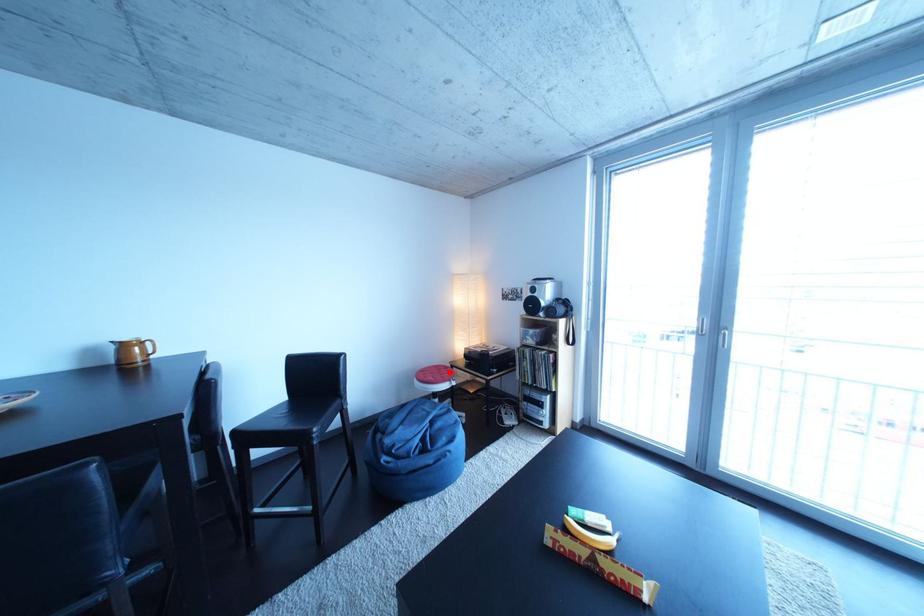
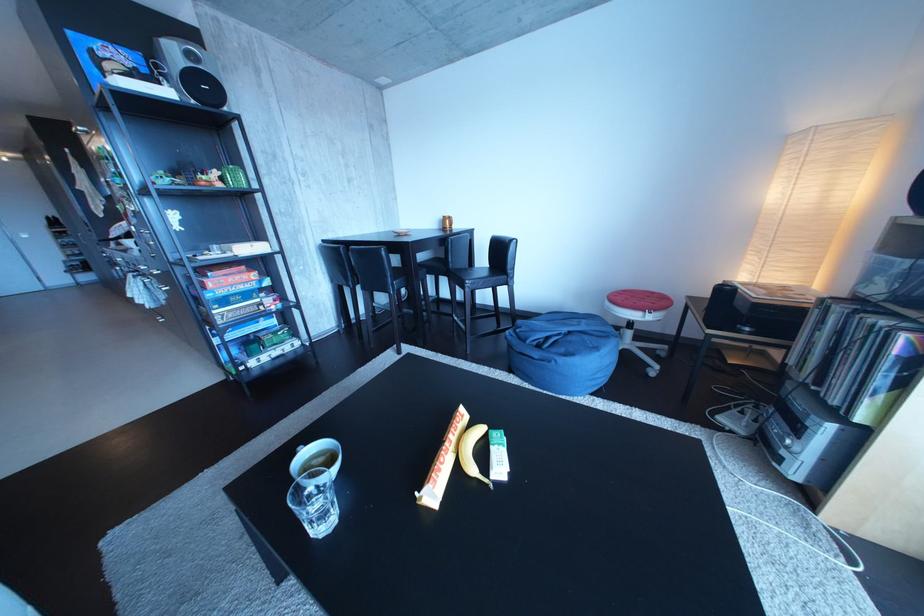
Where in the second image is the point corresponding to the highlighted location from the first image?

(666, 299)